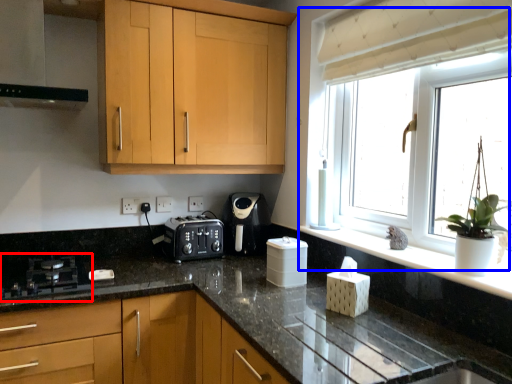
Question: Which of the following is the closest to the observer, gas stove (highlighted by a red box) or window (highlighted by a blue box)?

Choices:
 (A) gas stove
 (B) window

Answer: (B)